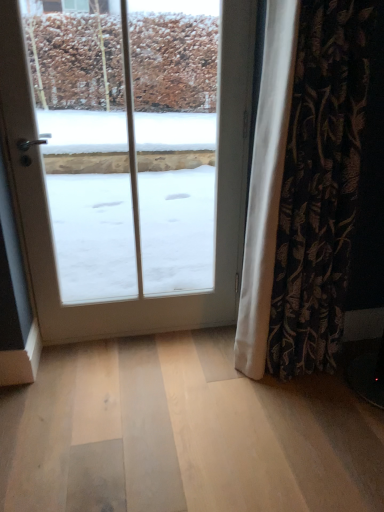
Locate an element on the screen. free space on the front side of black floral fabric curtain at right is located at coordinates (296, 425).